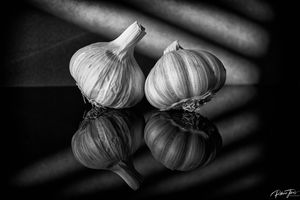
Locate an element on the screen. The image size is (300, 200). reflective surface is located at coordinates (44, 136), (258, 136).